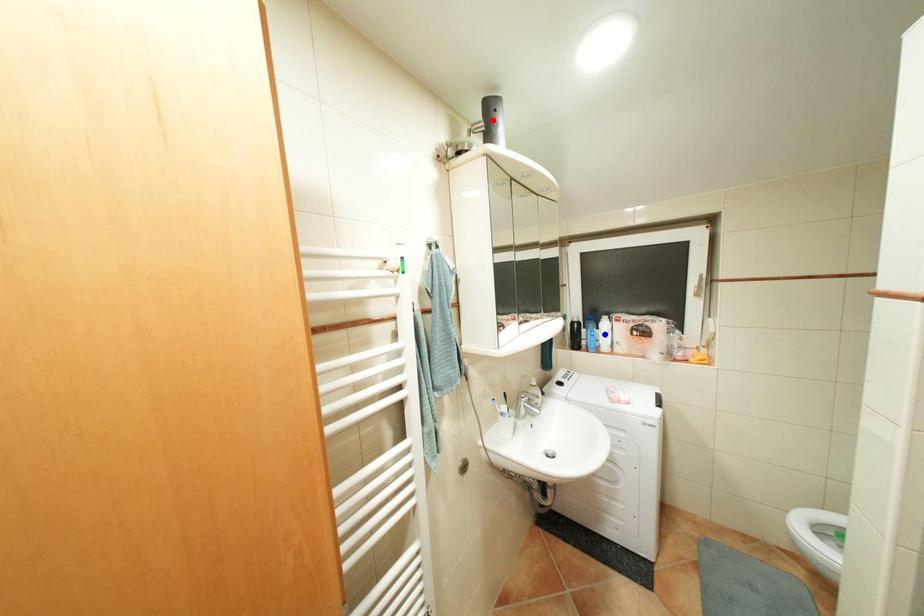
Question: Which of the two points in the image is closer to the camera?

Choices:
 (A) Blue point is closer.
 (B) Red point is closer.

Answer: (B)